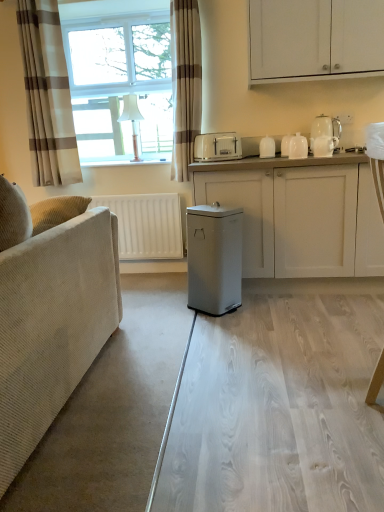
Question: From the image's perspective, is white glossy coffee machine at upper right located beneath transparent glass table at center?

Choices:
 (A) no
 (B) yes

Answer: (A)

Question: Can you confirm if white glossy coffee machine at upper right is positioned to the left of transparent glass table at center?

Choices:
 (A) no
 (B) yes

Answer: (A)

Question: Can you confirm if white glossy coffee machine at upper right is thinner than transparent glass table at center?

Choices:
 (A) no
 (B) yes

Answer: (B)

Question: Does white glossy coffee machine at upper right lie in front of transparent glass table at center?

Choices:
 (A) yes
 (B) no

Answer: (B)

Question: From a real-world perspective, is white glossy coffee machine at upper right physically above transparent glass table at center?

Choices:
 (A) yes
 (B) no

Answer: (A)

Question: Is white glossy coffee machine at upper right bigger or smaller than white plastic toaster at center, the first appliance from the left?

Choices:
 (A) big
 (B) small

Answer: (B)

Question: From the image's perspective, is white glossy coffee machine at upper right positioned above or below white plastic toaster at center, the first appliance from the left?

Choices:
 (A) above
 (B) below

Answer: (B)

Question: Is white glossy coffee machine at upper right inside the boundaries of white plastic toaster at center, the first appliance from the left, or outside?

Choices:
 (A) outside
 (B) inside

Answer: (A)

Question: Is white glossy coffee machine at upper right taller or shorter than white plastic toaster at center, placed as the 4th appliance when sorted from right to left?

Choices:
 (A) short
 (B) tall

Answer: (A)

Question: From a real-world perspective, is metallic gray trash can at center positioned above or below white matte cabinet at center, positioned as the 1th cabinetry in bottom-to-top order?

Choices:
 (A) below
 (B) above

Answer: (A)

Question: From their relative heights in the image, would you say metallic gray trash can at center is taller or shorter than white matte cabinet at center, the 2th cabinetry positioned from the top?

Choices:
 (A) tall
 (B) short

Answer: (B)

Question: In terms of width, does metallic gray trash can at center look wider or thinner when compared to white matte cabinet at center, the 2th cabinetry positioned from the top?

Choices:
 (A) wide
 (B) thin

Answer: (B)

Question: Is metallic gray trash can at center spatially inside white matte cabinet at center, the 2th cabinetry positioned from the top, or outside of it?

Choices:
 (A) outside
 (B) inside

Answer: (A)

Question: Is white glossy coffee machine at upper right in front of or behind white glossy jar at upper right, marked as the second appliance in a right-to-left arrangement, in the image?

Choices:
 (A) front
 (B) behind

Answer: (A)

Question: From a real-world perspective, is white glossy coffee machine at upper right positioned above or below white glossy jar at upper right, marked as the second appliance in a right-to-left arrangement?

Choices:
 (A) below
 (B) above

Answer: (B)